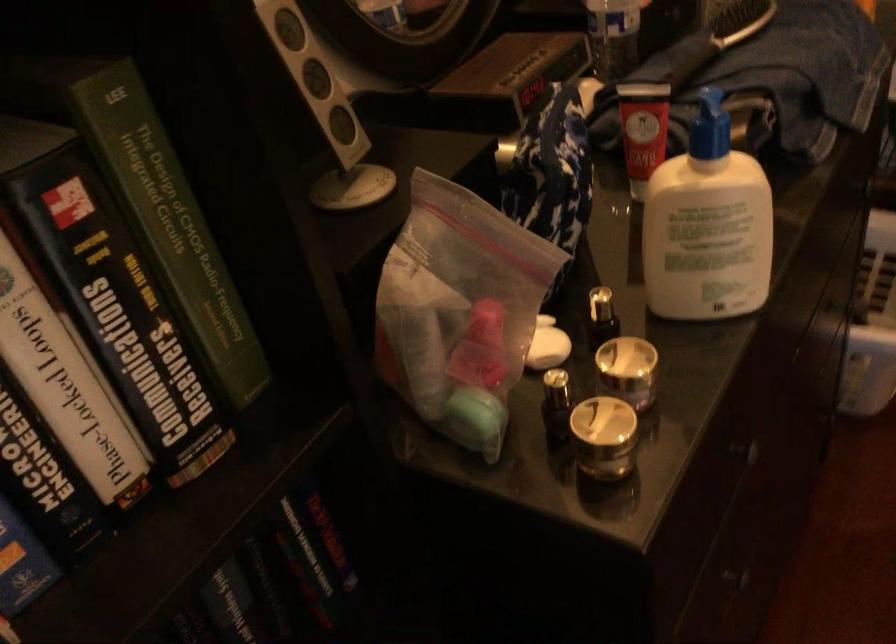
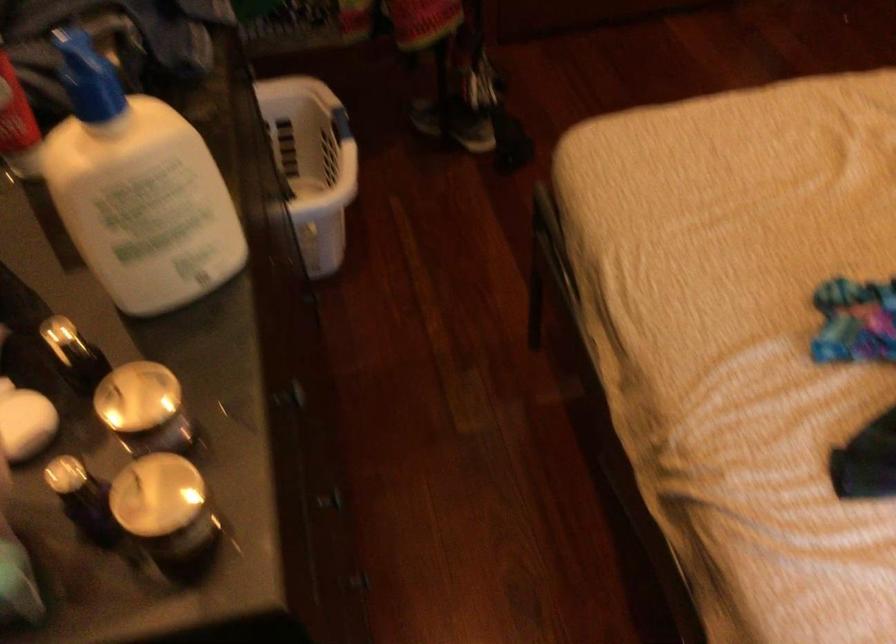
The point at (x=745, y=447) is marked in the first image. Where is the corresponding point in the second image?

(295, 393)